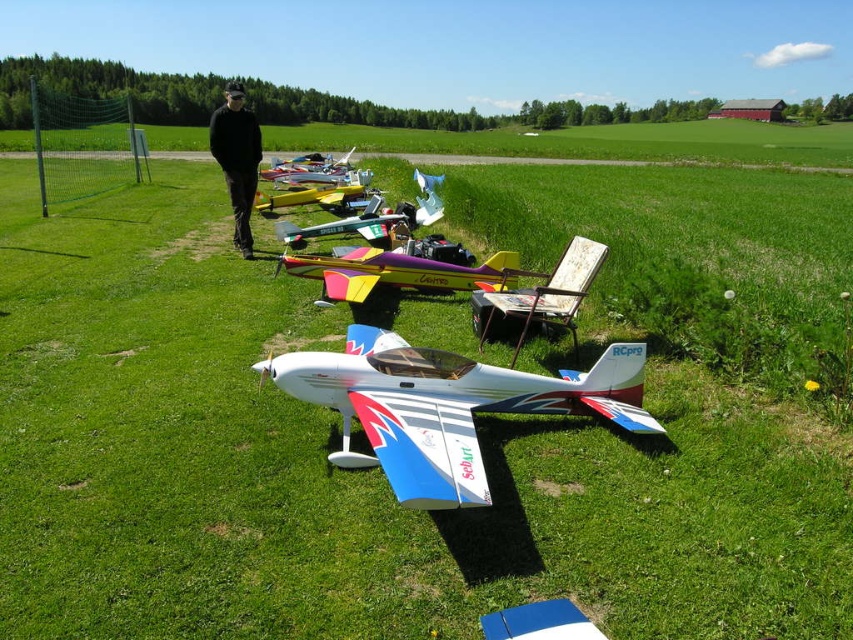
Who is lower down, yellow matte airplane at center or shiny metallic airplane at center?

Positioned lower is yellow matte airplane at center.

Does yellow matte airplane at center appear over shiny metallic airplane at center?

No.

Where is `yellow matte airplane at center`? yellow matte airplane at center is located at coordinates (308, 196).

The width and height of the screenshot is (853, 640). What are the coordinates of `yellow matte airplane at center` in the screenshot? It's located at (308, 196).

Does shiny yellow and purple airplane at center have a larger size compared to shiny metallic airplane at center?

No.

Who is lower down, shiny yellow and purple airplane at center or shiny metallic airplane at center?

Positioned lower is shiny yellow and purple airplane at center.

Where is `shiny yellow and purple airplane at center`? Image resolution: width=853 pixels, height=640 pixels. shiny yellow and purple airplane at center is located at coordinates (397, 273).

Is black matte clothing at center wider than shiny metallic airplane at center?

In fact, black matte clothing at center might be narrower than shiny metallic airplane at center.

Who is more forward, [247,243] or [291,160]?

Point [247,243] is more forward.

You are a GUI agent. You are given a task and a screenshot of the screen. Output one action in this format:
    pyautogui.click(x=<x>, y=<y>)
    Task: Click on the black matte clothing at center
    This screenshot has height=640, width=853.
    Given the screenshot: What is the action you would take?
    pyautogui.click(x=236, y=157)